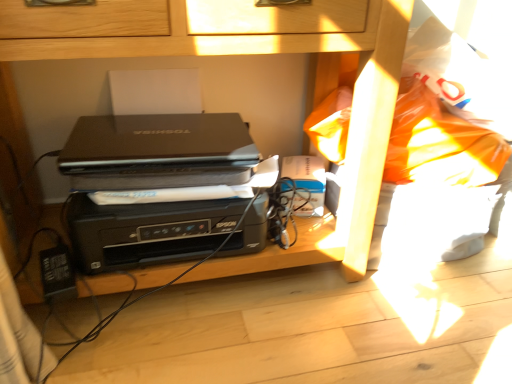
Question: Is black plastic printer at center far away from black matte laptop at center?

Choices:
 (A) no
 (B) yes

Answer: (A)

Question: Is black plastic printer at center further to the viewer compared to black matte laptop at center?

Choices:
 (A) yes
 (B) no

Answer: (A)

Question: From a real-world perspective, is black plastic printer at center physically above black matte laptop at center?

Choices:
 (A) yes
 (B) no

Answer: (B)

Question: From a real-world perspective, is black plastic printer at center below black matte laptop at center?

Choices:
 (A) no
 (B) yes

Answer: (B)

Question: Considering the relative sizes of black plastic printer at center and black matte laptop at center in the image provided, is black plastic printer at center taller than black matte laptop at center?

Choices:
 (A) no
 (B) yes

Answer: (B)

Question: Would you say black plastic printer at center is inside or outside black plastic printer at center?

Choices:
 (A) inside
 (B) outside

Answer: (A)

Question: In terms of size, does black plastic printer at center appear bigger or smaller than black plastic printer at center?

Choices:
 (A) big
 (B) small

Answer: (B)

Question: Is point (188, 175) positioned closer to the camera than point (62, 56)?

Choices:
 (A) closer
 (B) farther

Answer: (B)

Question: Based on their positions, is black plastic printer at center located to the left or right of black plastic printer at center?

Choices:
 (A) left
 (B) right

Answer: (A)

Question: Would you say black plastic printer at center is to the left or to the right of black plastic printer at center in the picture?

Choices:
 (A) right
 (B) left

Answer: (A)

Question: From a real-world perspective, relative to black plastic printer at center, is black plastic printer at center vertically above or below?

Choices:
 (A) above
 (B) below

Answer: (A)

Question: From their relative heights in the image, would you say black plastic printer at center is taller or shorter than black plastic printer at center?

Choices:
 (A) short
 (B) tall

Answer: (B)

Question: Is point (369, 18) positioned closer to the camera than point (72, 228)?

Choices:
 (A) closer
 (B) farther

Answer: (A)

Question: In terms of size, does matte black laptop at center appear bigger or smaller than black plastic printer at center?

Choices:
 (A) big
 (B) small

Answer: (B)

Question: Based on their positions, is matte black laptop at center located to the left or right of black plastic printer at center?

Choices:
 (A) left
 (B) right

Answer: (A)